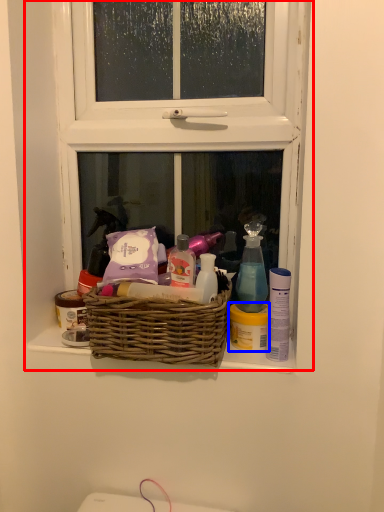
Question: Which of the following is the farthest to the observer, window (highlighted by a red box) or toiletry (highlighted by a blue box)?

Choices:
 (A) window
 (B) toiletry

Answer: (B)